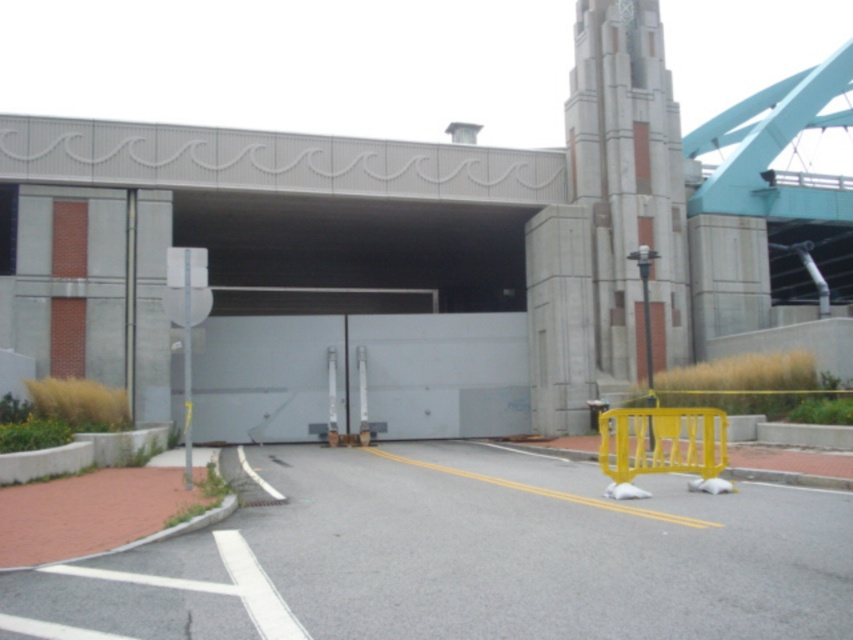
Who is lower down, gray concrete parking garage at center or yellow plastic barricade at lower right?

yellow plastic barricade at lower right is below.

You are a GUI agent. You are given a task and a screenshot of the screen. Output one action in this format:
    pyautogui.click(x=<x>, y=<y>)
    Task: Click on the gray concrete parking garage at center
    This screenshot has height=640, width=853.
    Given the screenshot: What is the action you would take?
    pyautogui.click(x=303, y=276)